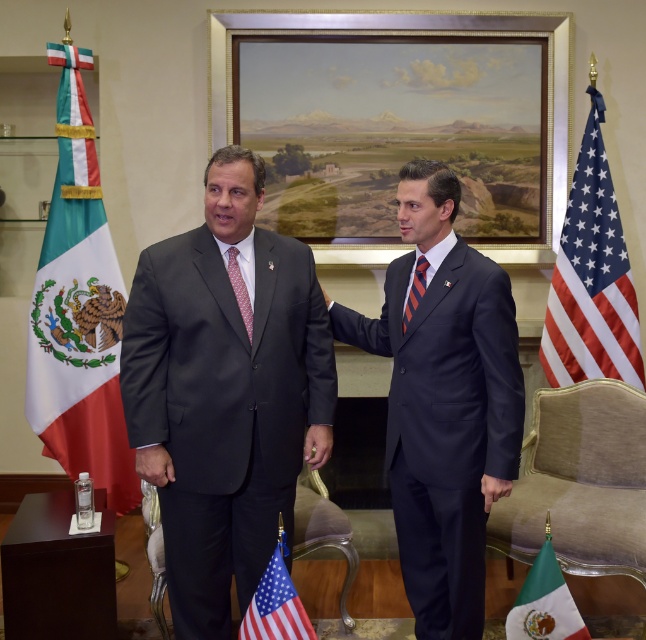
Question: Based on their relative distances, which object is nearer to the red silk tie at center?

Choices:
 (A) matte black suit at center
 (B) dark blue suit at center

Answer: (A)

Question: Can you confirm if silky blue-white stars and stripes at upper right is positioned above red silk tie at center?

Choices:
 (A) no
 (B) yes

Answer: (B)

Question: Is dark blue suit at center below silky blue-white stars and stripes at upper right?

Choices:
 (A) no
 (B) yes

Answer: (B)

Question: Which point is closer to the camera taking this photo?

Choices:
 (A) (413, 536)
 (B) (238, 280)
 (C) (284, 364)
 (D) (516, 609)

Answer: (D)

Question: Is the position of silky blue-white stars and stripes at upper right more distant than that of wooden framed painting at center?

Choices:
 (A) yes
 (B) no

Answer: (B)

Question: Which point is farther from the camera taking this photo?

Choices:
 (A) (234, 298)
 (B) (559, 600)

Answer: (A)